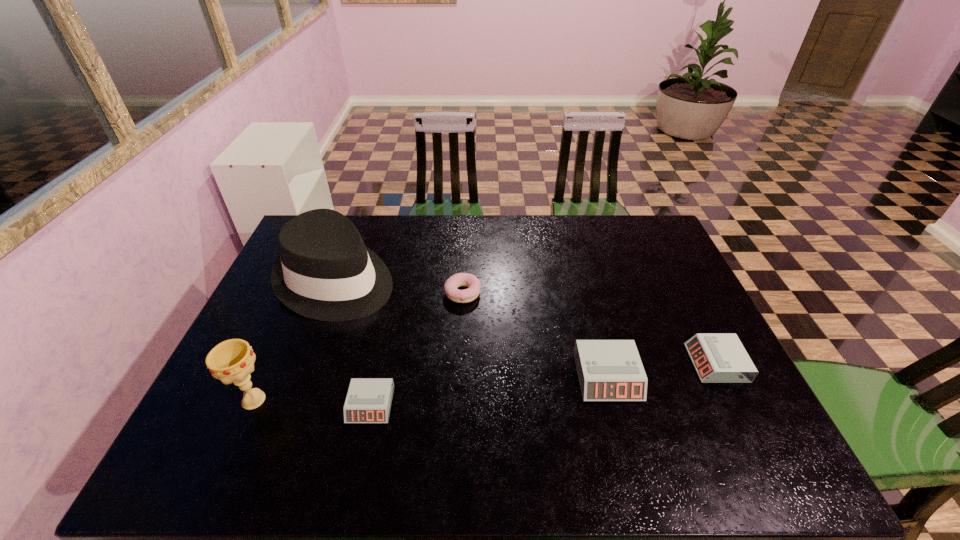
Locate an element on the screen. vacant position for inserting another alarm_clock evenly is located at coordinates (492, 390).